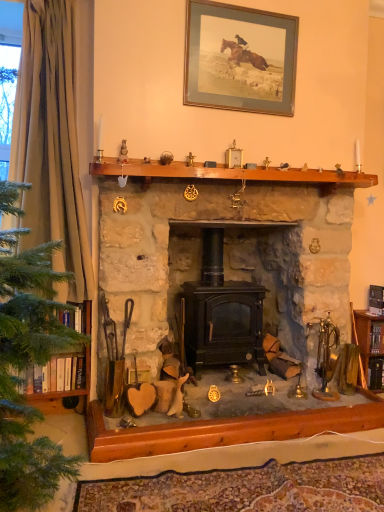
Locate an element on the screen. free space underneath gold-framed print at upper center (from a real-world perspective) is located at coordinates (221, 163).